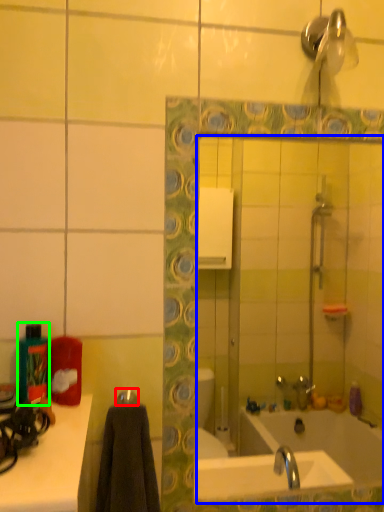
Question: Which is farther away from towel bar (highlighted by a red box)? mirror (highlighted by a blue box) or bottle (highlighted by a green box)?

Choices:
 (A) mirror
 (B) bottle

Answer: (A)